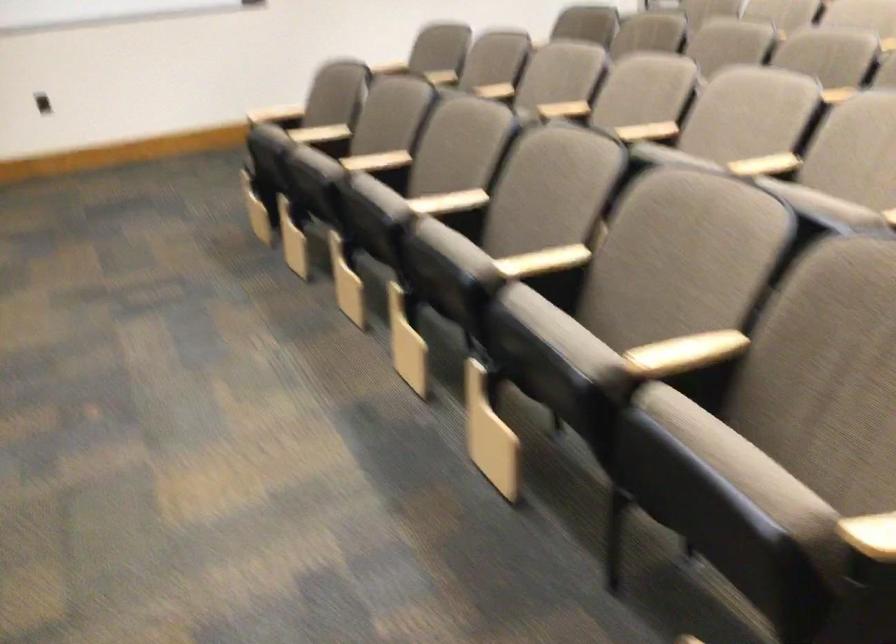
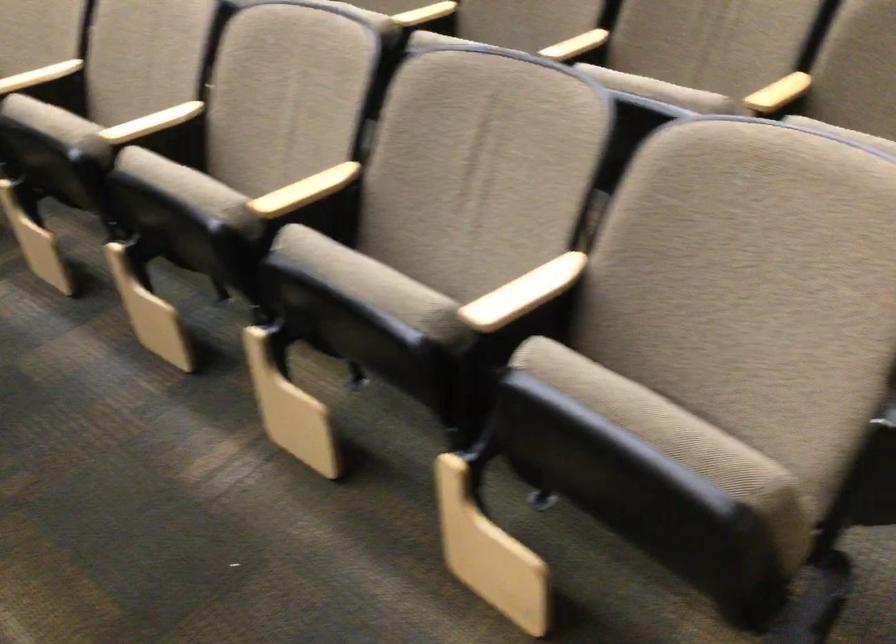
Where in the second image is the point corresponding to (x=789, y=161) from the first image?

(39, 76)